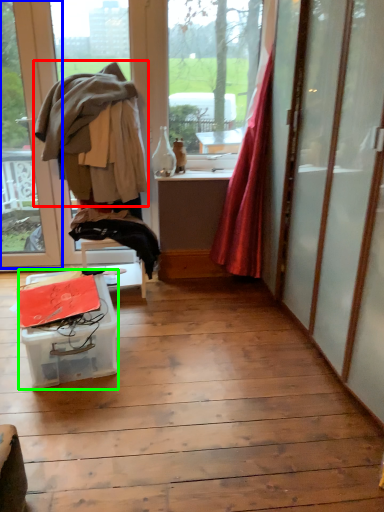
Question: Considering the real-world distances, which object is closest to clothing (highlighted by a red box)? window (highlighted by a blue box) or table (highlighted by a green box).

Choices:
 (A) window
 (B) table

Answer: (A)